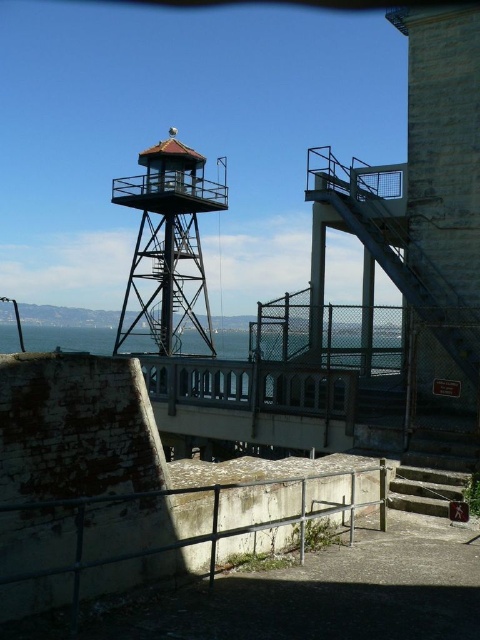
Question: Does metallic red observation tower at upper left have a greater width compared to concrete stairs at lower right?

Choices:
 (A) no
 (B) yes

Answer: (B)

Question: Among these objects, which one is nearest to the camera?

Choices:
 (A) rusty metal railing at lower center
 (B) concrete stairs at lower right
 (C) metallic red observation tower at upper left

Answer: (A)

Question: Which object is closer to the camera taking this photo?

Choices:
 (A) concrete stairs at lower right
 (B) rusty metal railing at lower center
 (C) metallic red observation tower at upper left

Answer: (B)

Question: Which of the following is the closest to the observer?

Choices:
 (A) (179, 348)
 (B) (442, 483)
 (C) (235, 536)

Answer: (C)

Question: Does rusty metal railing at lower center have a lesser width compared to metallic red observation tower at upper left?

Choices:
 (A) no
 (B) yes

Answer: (B)

Question: Does metallic red observation tower at upper left appear under concrete stairs at lower right?

Choices:
 (A) yes
 (B) no

Answer: (B)